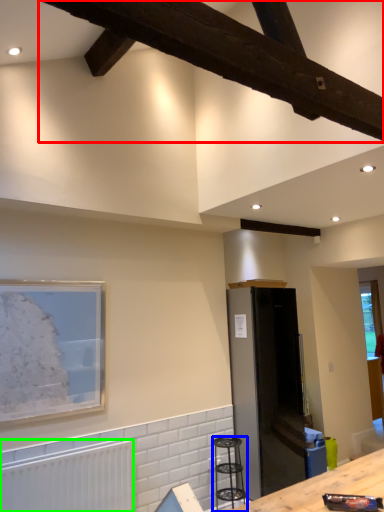
Question: Estimate the real-world distances between objects in this image. Which object is closer to exhaust hood (highlighted by a red box), bar stool (highlighted by a blue box) or radiator (highlighted by a green box)?

Choices:
 (A) bar stool
 (B) radiator

Answer: (B)